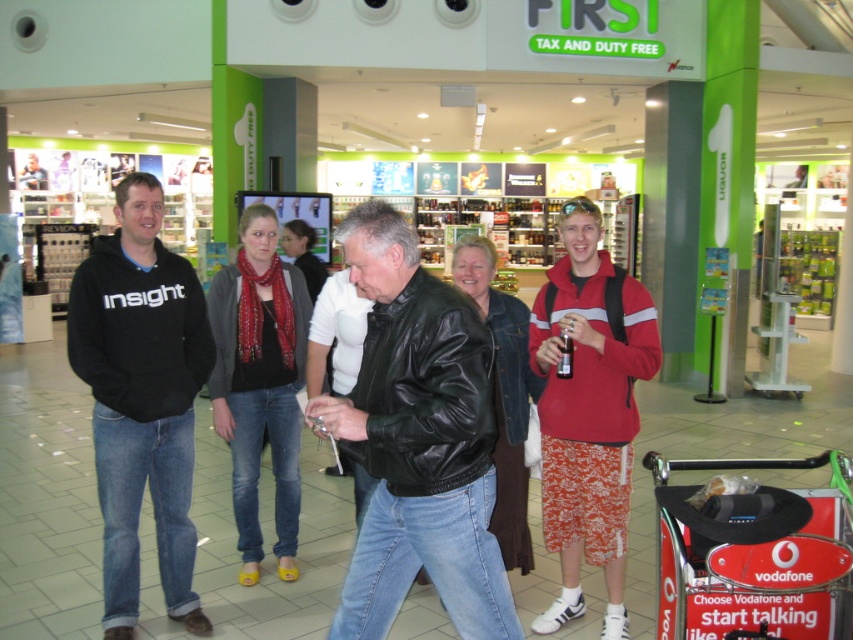
Question: Is black leather jacket at center closer to camera compared to red polyester hoodie at center?

Choices:
 (A) yes
 (B) no

Answer: (A)

Question: Is black leather jacket at center bigger than red polyester hoodie at center?

Choices:
 (A) yes
 (B) no

Answer: (B)

Question: Does black leather jacket at center have a lesser width compared to black hoodie at left?

Choices:
 (A) yes
 (B) no

Answer: (B)

Question: Among these objects, which one is farthest from the camera?

Choices:
 (A) red polyester hoodie at center
 (B) black leather jacket at center

Answer: (A)

Question: Which of the following is the farthest from the observer?

Choices:
 (A) (90, 362)
 (B) (601, 227)
 (C) (399, 332)

Answer: (B)

Question: Considering the real-world distances, which object is closest to the black hoodie at left?

Choices:
 (A) black leather jacket at center
 (B) red polyester hoodie at center

Answer: (A)